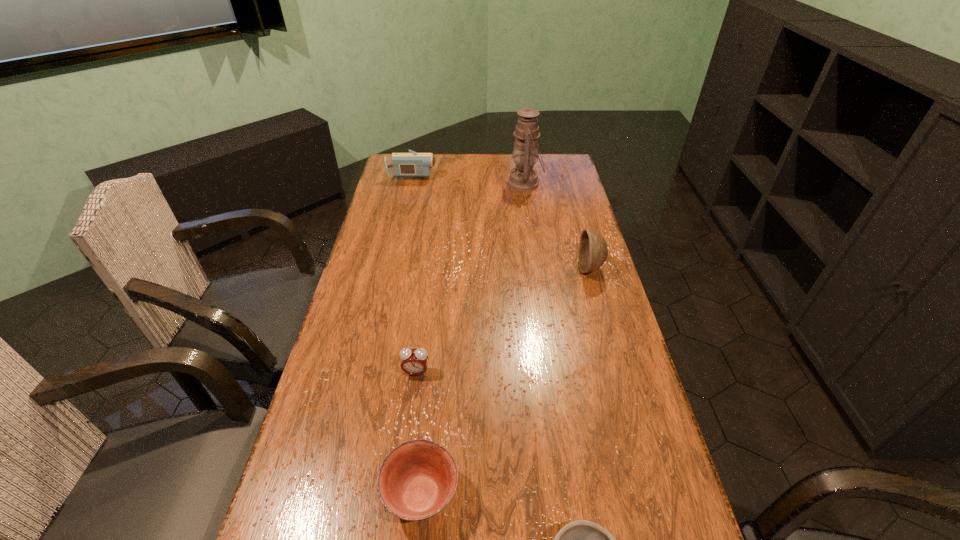
Identify which bowl is the nearest to the rightmost bowl. Please provide its 2D coordinates. Your answer should be formatted as a tuple, i.e. [(x, y)], where the tuple contains the x and y coordinates of a point satisfying the conditions above.

[(417, 479)]

Image resolution: width=960 pixels, height=540 pixels. Identify the location of bowl that stands as the closest to the leftmost bowl. (581, 539).

Where is `free space that satisfies the following two spatial constraints: 1. on the back side of the tallest object; 2. on the side of the camcorder with the flip-out screen`? free space that satisfies the following two spatial constraints: 1. on the back side of the tallest object; 2. on the side of the camcorder with the flip-out screen is located at coordinates (524, 173).

Locate an element on the screen. blank area in the image that satisfies the following two spatial constraints: 1. on the back side of the oil lamp; 2. on the right side of the fifth tallest object is located at coordinates (451, 183).

The image size is (960, 540). In order to click on free location that satisfies the following two spatial constraints: 1. on the clock face of the second shortest bowl; 2. on the right side of the alarm clock in this screenshot , I will do `click(400, 495)`.

This screenshot has height=540, width=960. What are the coordinates of `free spot that satisfies the following two spatial constraints: 1. on the side of the camcorder with the flip-out screen; 2. on the left side of the second shortest bowl` in the screenshot? It's located at (341, 495).